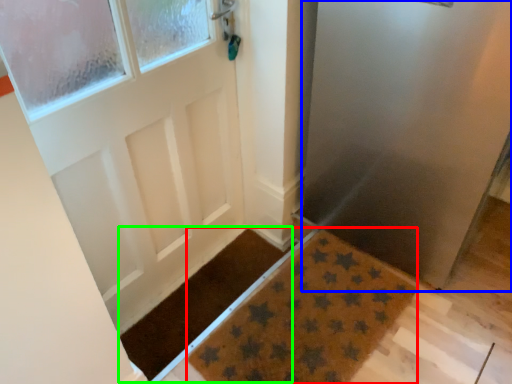
Question: Which is farther away from doormat (highlighted by a red box)? screen door (highlighted by a blue box) or doormat (highlighted by a green box)?

Choices:
 (A) screen door
 (B) doormat

Answer: (A)